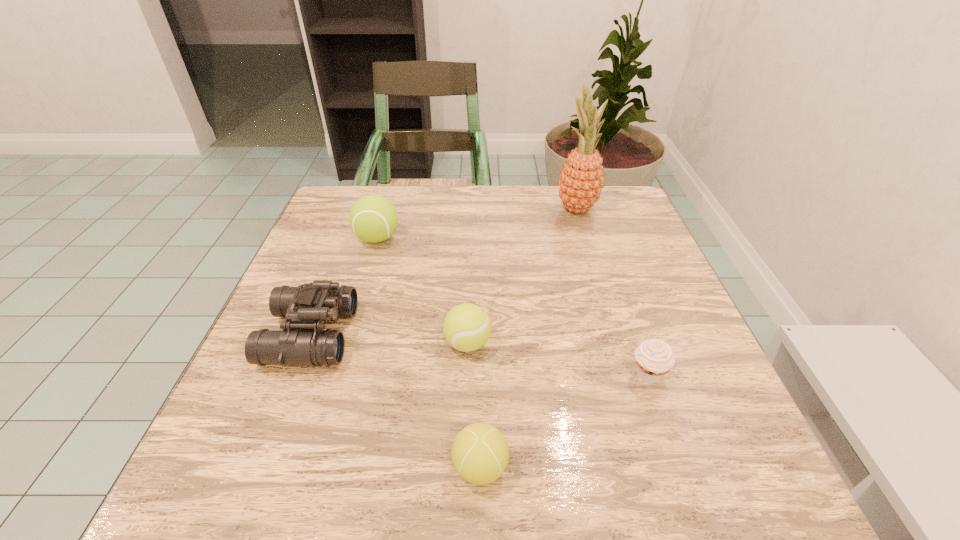
This screenshot has width=960, height=540. What are the coordinates of `blank space located through the lenses of the binoculars` in the screenshot? It's located at (387, 335).

The height and width of the screenshot is (540, 960). Find the location of `vacant space located 0.130m on the back of the second farthest tennis ball`. vacant space located 0.130m on the back of the second farthest tennis ball is located at coordinates (469, 282).

Locate an element on the screen. The height and width of the screenshot is (540, 960). free region located 0.170m on the front of the muffin is located at coordinates (688, 492).

Identify the location of free space located on the left of the nearest tennis ball. (229, 467).

Find the location of a particular element. The width and height of the screenshot is (960, 540). pineapple present at the far edge is located at coordinates click(x=581, y=180).

Locate an element on the screen. Image resolution: width=960 pixels, height=540 pixels. tennis ball that is at the far edge is located at coordinates (373, 218).

Where is `object that is at the near edge`? object that is at the near edge is located at coordinates pyautogui.click(x=480, y=453).

This screenshot has height=540, width=960. What are the coordinates of `tennis ball located in the left edge section of the desktop` in the screenshot? It's located at (373, 218).

You are a GUI agent. You are given a task and a screenshot of the screen. Output one action in this format:
    pyautogui.click(x=<x>, y=<y>)
    Task: Click on the binoculars situated at the left edge
    The image size is (960, 540).
    Given the screenshot: What is the action you would take?
    pyautogui.click(x=303, y=342)

Identify the location of pineapple located at the right edge. (581, 180).